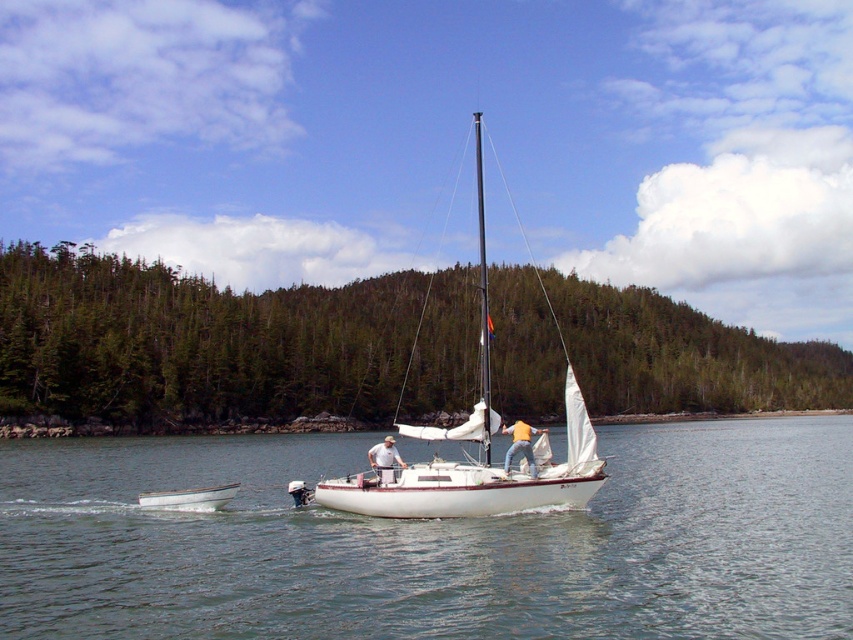
Who is taller, yellow cotton shirt at center or white fabric sailboat at center?

With more height is yellow cotton shirt at center.

Which is more to the right, yellow cotton shirt at center or white fabric sailboat at center?

From the viewer's perspective, yellow cotton shirt at center appears more on the right side.

Which is in front, point (532, 472) or point (376, 445)?

Positioned in front is point (532, 472).

The image size is (853, 640). I want to click on yellow cotton shirt at center, so click(521, 444).

Which is below, black polished mast at center or white matte dinghy at lower left?

Positioned lower is white matte dinghy at lower left.

Is black polished mast at center thinner than white matte dinghy at lower left?

In fact, black polished mast at center might be wider than white matte dinghy at lower left.

Is point (483, 209) behind point (190, 504)?

Yes, point (483, 209) is behind point (190, 504).

Locate an element on the screen. black polished mast at center is located at coordinates (482, 298).

Between clear water at center and white matte dinghy at lower left, which one appears on the left side from the viewer's perspective?

Positioned to the left is white matte dinghy at lower left.

This screenshot has height=640, width=853. Find the location of `clear water at center`. clear water at center is located at coordinates (433, 541).

Locate an element on the screen. The image size is (853, 640). clear water at center is located at coordinates (433, 541).